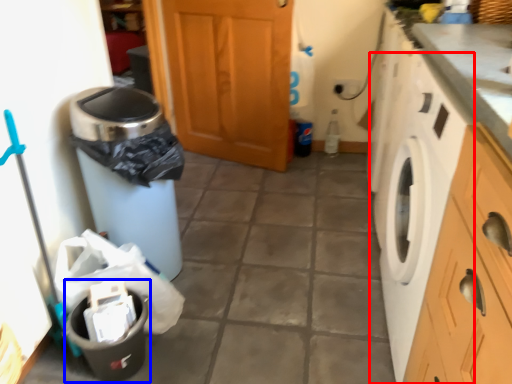
Question: Which object appears farthest to the camera in this image, washing machine (highlighted by a red box) or recycling bin (highlighted by a blue box)?

Choices:
 (A) washing machine
 (B) recycling bin

Answer: (B)